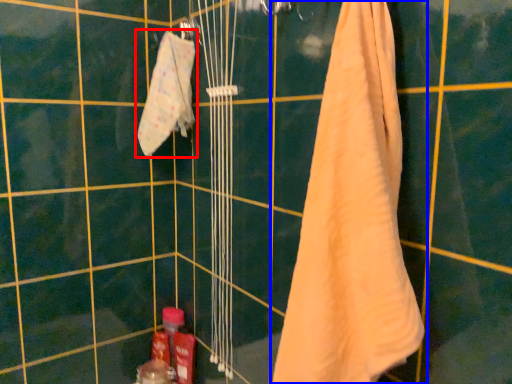
Question: Which of the following is the closest to the observer, towel (highlighted by a red box) or towel (highlighted by a blue box)?

Choices:
 (A) towel
 (B) towel

Answer: (B)